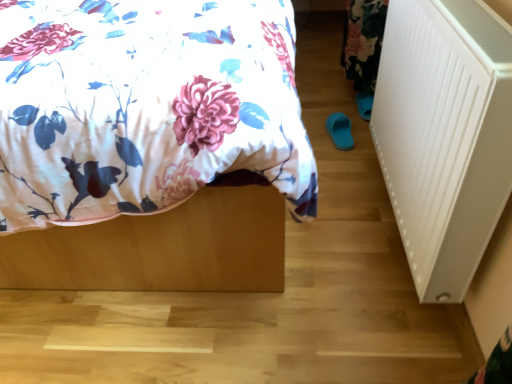
The width and height of the screenshot is (512, 384). What do you see at coordinates (444, 136) in the screenshot? I see `white plastic radiator at right` at bounding box center [444, 136].

Find the location of a particular element. The image size is (512, 384). white plastic radiator at right is located at coordinates (444, 136).

Where is `floral fabric bed at center`? The width and height of the screenshot is (512, 384). floral fabric bed at center is located at coordinates (149, 144).

What do you see at coordinates (149, 144) in the screenshot?
I see `floral fabric bed at center` at bounding box center [149, 144].

Where is `white plastic radiator at right`? The width and height of the screenshot is (512, 384). white plastic radiator at right is located at coordinates (444, 136).

Does floral fabric bed at center appear on the left side of white plastic radiator at right?

Yes.

Based on the photo, is the depth of floral fabric bed at center less than that of white plastic radiator at right?

Yes, it is.

Does point (8, 58) come farther from viewer compared to point (406, 232)?

No, (8, 58) is in front of (406, 232).

From the image's perspective, is floral fabric bed at center under white plastic radiator at right?

No.

From a real-world perspective, is floral fabric bed at center positioned under white plastic radiator at right based on gravity?

No, from a real-world perspective, floral fabric bed at center is not beneath white plastic radiator at right.

Which object is thinner, floral fabric bed at center or white plastic radiator at right?

With smaller width is white plastic radiator at right.

Consider the image. Is floral fabric bed at center shorter than white plastic radiator at right?

In fact, floral fabric bed at center may be taller than white plastic radiator at right.

Looking at the image, does floral fabric bed at center seem bigger or smaller compared to white plastic radiator at right?

Clearly, floral fabric bed at center is larger in size than white plastic radiator at right.

Would you say white plastic radiator at right is part of floral fabric bed at center's contents?

Actually, white plastic radiator at right is outside floral fabric bed at center.

Consider the image. Is floral fabric bed at center next to white plastic radiator at right and touching it?

floral fabric bed at center and white plastic radiator at right are not in contact.

Could you tell me if floral fabric bed at center is facing white plastic radiator at right?

No, floral fabric bed at center does not turn towards white plastic radiator at right.

Looking at this image, what's the angular difference between floral fabric bed at center and white plastic radiator at right's facing directions?

90.2 degrees separate the facing orientations of floral fabric bed at center and white plastic radiator at right.

Where is `bed on the left of white plastic radiator at right`? bed on the left of white plastic radiator at right is located at coordinates (149, 144).

Does white plastic radiator at right appear on the left side of floral fabric bed at center?

No.

Which object is closer to the camera taking this photo, white plastic radiator at right or floral fabric bed at center?

Positioned in front is floral fabric bed at center.

Does point (449, 72) lie in front of point (210, 156)?

No, it is not.

From the image's perspective, which one is positioned lower, white plastic radiator at right or floral fabric bed at center?

white plastic radiator at right is shown below in the image.

From a real-world perspective, is white plastic radiator at right above or below floral fabric bed at center?

From a real-world perspective, white plastic radiator at right is physically below floral fabric bed at center.

Does white plastic radiator at right have a lesser width compared to floral fabric bed at center?

Correct, the width of white plastic radiator at right is less than that of floral fabric bed at center.

Does white plastic radiator at right have a lesser height compared to floral fabric bed at center?

Indeed, white plastic radiator at right has a lesser height compared to floral fabric bed at center.

Does white plastic radiator at right have a smaller size compared to floral fabric bed at center?

Yes.

Is white plastic radiator at right not inside floral fabric bed at center?

Indeed, white plastic radiator at right is completely outside floral fabric bed at center.

Can you see white plastic radiator at right touching floral fabric bed at center?

No, white plastic radiator at right is not making contact with floral fabric bed at center.

Is white plastic radiator at right facing away from floral fabric bed at center?

That's not correct — white plastic radiator at right is not looking away from floral fabric bed at center.

How many degrees apart are the facing directions of white plastic radiator at right and floral fabric bed at center?

The facing directions of white plastic radiator at right and floral fabric bed at center are 90.2 degrees apart.

I want to click on radiator that appears on the right of floral fabric bed at center, so click(x=444, y=136).

Identify the location of radiator on the right of floral fabric bed at center. (444, 136).

Image resolution: width=512 pixels, height=384 pixels. What are the coordinates of `bed in front of the white plastic radiator at right` in the screenshot? It's located at (149, 144).